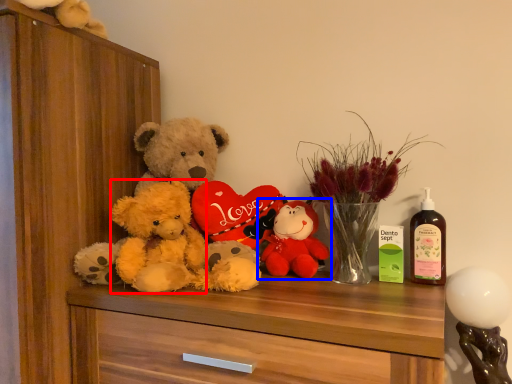
Question: Which of the following is the closest to the observer, teddy (highlighted by a red box) or toy (highlighted by a blue box)?

Choices:
 (A) teddy
 (B) toy

Answer: (A)